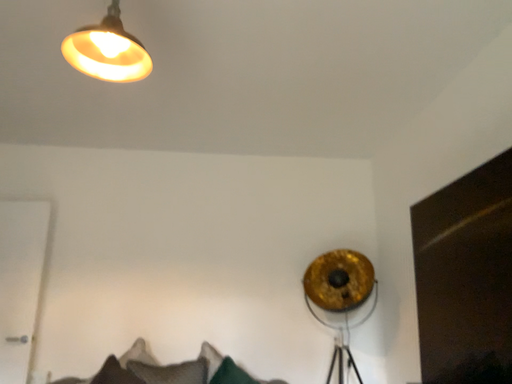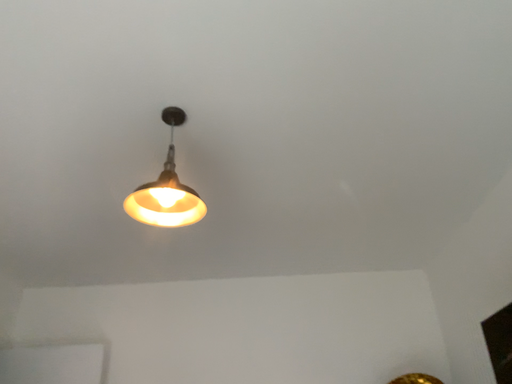
Question: How did the camera likely rotate when shooting the video?

Choices:
 (A) rotated downward
 (B) rotated upward

Answer: (B)